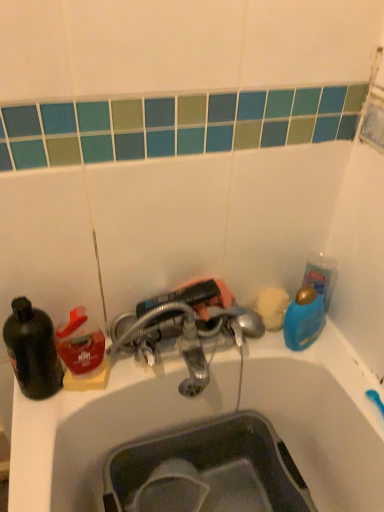
Question: In the image, is translucent plastic bottle at left positioned in front of or behind matte gray sink at lower center?

Choices:
 (A) behind
 (B) front

Answer: (B)

Question: Is translucent plastic bottle at left wider or thinner than matte gray sink at lower center?

Choices:
 (A) wide
 (B) thin

Answer: (B)

Question: Which object is the farthest from the matte gray sink at lower center?

Choices:
 (A) metallic silver faucet at center
 (B) blue glossy bottle at upper right
 (C) black matte bottle at left
 (D) translucent plastic bottle at left

Answer: (C)

Question: Which object is the farthest from the blue glossy bottle at upper right?

Choices:
 (A) matte gray sink at lower center
 (B) metallic silver faucet at center
 (C) translucent plastic bottle at left
 (D) black matte bottle at left

Answer: (D)